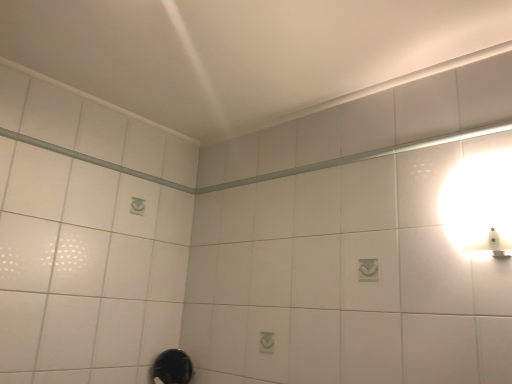
Question: Does black rubber shower at lower center lie behind white glossy wall sconce at upper right?

Choices:
 (A) yes
 (B) no

Answer: (A)

Question: Is black rubber shower at lower center positioned before white glossy wall sconce at upper right?

Choices:
 (A) yes
 (B) no

Answer: (B)

Question: Does black rubber shower at lower center have a greater width compared to white glossy wall sconce at upper right?

Choices:
 (A) yes
 (B) no

Answer: (A)

Question: Considering the relative sizes of black rubber shower at lower center and white glossy wall sconce at upper right in the image provided, is black rubber shower at lower center thinner than white glossy wall sconce at upper right?

Choices:
 (A) yes
 (B) no

Answer: (B)

Question: Does black rubber shower at lower center have a greater height compared to white glossy wall sconce at upper right?

Choices:
 (A) yes
 (B) no

Answer: (A)

Question: Is black rubber shower at lower center turned away from white glossy wall sconce at upper right?

Choices:
 (A) no
 (B) yes

Answer: (A)

Question: From the image's perspective, is white glossy wall sconce at upper right on black rubber shower at lower center?

Choices:
 (A) yes
 (B) no

Answer: (A)

Question: Is white glossy wall sconce at upper right outside of black rubber shower at lower center?

Choices:
 (A) yes
 (B) no

Answer: (A)

Question: Is white glossy wall sconce at upper right positioned far away from black rubber shower at lower center?

Choices:
 (A) no
 (B) yes

Answer: (B)

Question: From the image's perspective, does white glossy wall sconce at upper right appear lower than black rubber shower at lower center?

Choices:
 (A) no
 (B) yes

Answer: (A)

Question: Is white glossy wall sconce at upper right positioned before black rubber shower at lower center?

Choices:
 (A) no
 (B) yes

Answer: (B)

Question: Does white glossy wall sconce at upper right have a greater width compared to black rubber shower at lower center?

Choices:
 (A) yes
 (B) no

Answer: (B)

Question: In the image, is white glossy wall sconce at upper right on the left side or the right side of black rubber shower at lower center?

Choices:
 (A) right
 (B) left

Answer: (A)